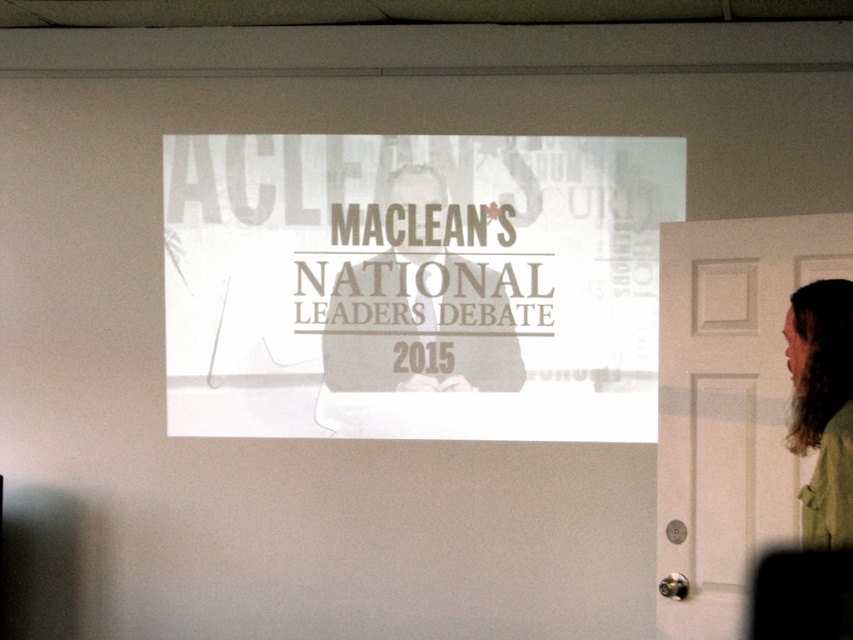
You are standing in a room with a projection screen showing a debate. You need to exit through the door on the right. To your left, there is a white paper at center and a green matte jacket at right. Which object is closer to the door?

The green matte jacket at right is closer to the door because it is positioned to the right of the white paper at center, which is closer to the door on the right side of the room.

You are a guest at an event and see the white paper at center and the matte paper sign at center. Which one is closer to the floor?

The white paper at center is closer to the floor because it is positioned under the matte paper sign at center.

You are a stagehand who needs to place a 2.5 meter long ladder between the white paper at center and the green matte jacket at right. Can the ladder fit horizontally between them without overlapping either object?

The distance between the white paper at center and the green matte jacket at right is 1.87 meters. Since the ladder is 2.5 meters long, it cannot fit horizontally between them without overlapping either object.